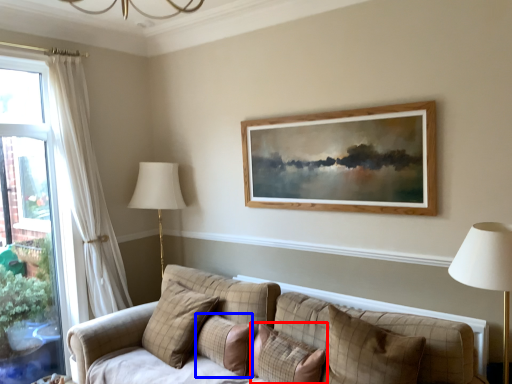
Question: Which object is closer to the camera taking this photo, pillow (highlighted by a red box) or pillow (highlighted by a blue box)?

Choices:
 (A) pillow
 (B) pillow

Answer: (A)